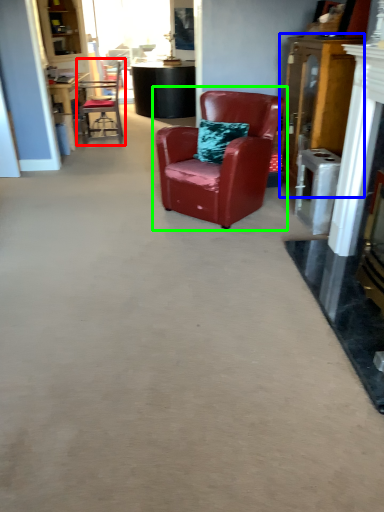
Question: Considering the real-world distances, which object is farthest from chair (highlighted by a red box)? dresser (highlighted by a blue box) or chair (highlighted by a green box)?

Choices:
 (A) dresser
 (B) chair

Answer: (A)